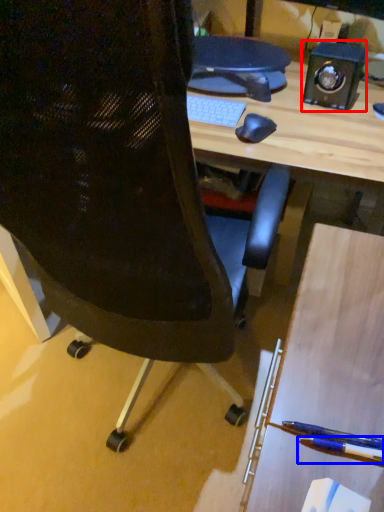
Question: Which object appears closest to the camera in this image, speaker (highlighted by a red box) or pencil (highlighted by a blue box)?

Choices:
 (A) speaker
 (B) pencil

Answer: (B)